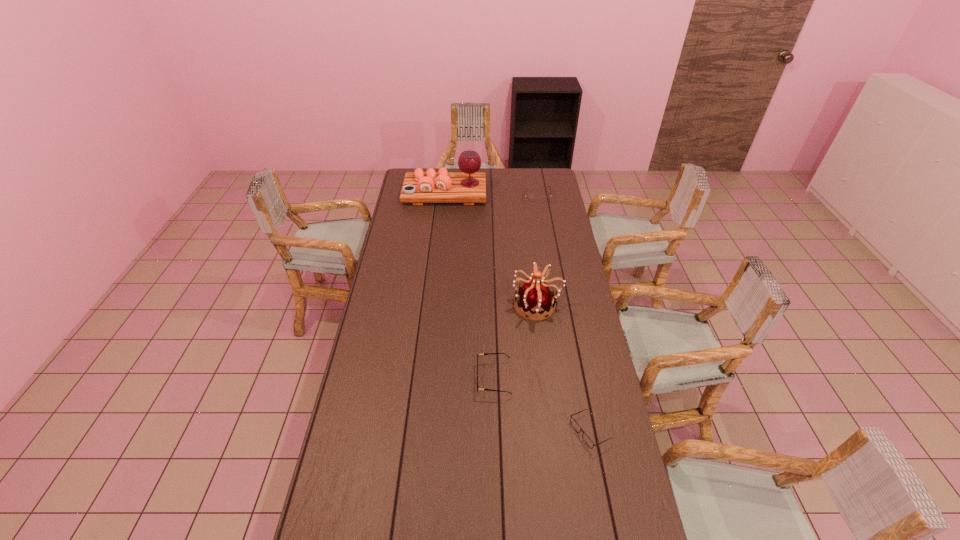
Where is `tiara that is at the right edge`? The image size is (960, 540). tiara that is at the right edge is located at coordinates (535, 296).

At what (x,y) coordinates should I click in order to perform the action: click on object located in the far left corner section of the desktop. Please return your answer as a coordinate pair (x, y). The height and width of the screenshot is (540, 960). Looking at the image, I should click on [x=468, y=186].

Find the location of `object located in the far right corner section of the desktop`. object located in the far right corner section of the desktop is located at coordinates (530, 199).

Where is `blank space at the far edge of the desktop`? blank space at the far edge of the desktop is located at coordinates (502, 181).

The image size is (960, 540). Find the location of `free region at the right edge`. free region at the right edge is located at coordinates (553, 221).

Locate an element on the screen. This screenshot has width=960, height=540. free space between the nearest object and the second nearest object is located at coordinates point(542,405).

Where is `free space that is in between the platter and the fourth farthest object`? This screenshot has width=960, height=540. free space that is in between the platter and the fourth farthest object is located at coordinates (469, 286).

The width and height of the screenshot is (960, 540). What are the coordinates of `free area in between the fourth farthest object and the platter` in the screenshot? It's located at (469, 286).

I want to click on vacant area that lies between the nearest spectacles and the farthest spectacles, so click(x=564, y=314).

Image resolution: width=960 pixels, height=540 pixels. Find the location of `free point between the platter and the leftmost spectacles`. free point between the platter and the leftmost spectacles is located at coordinates (469, 286).